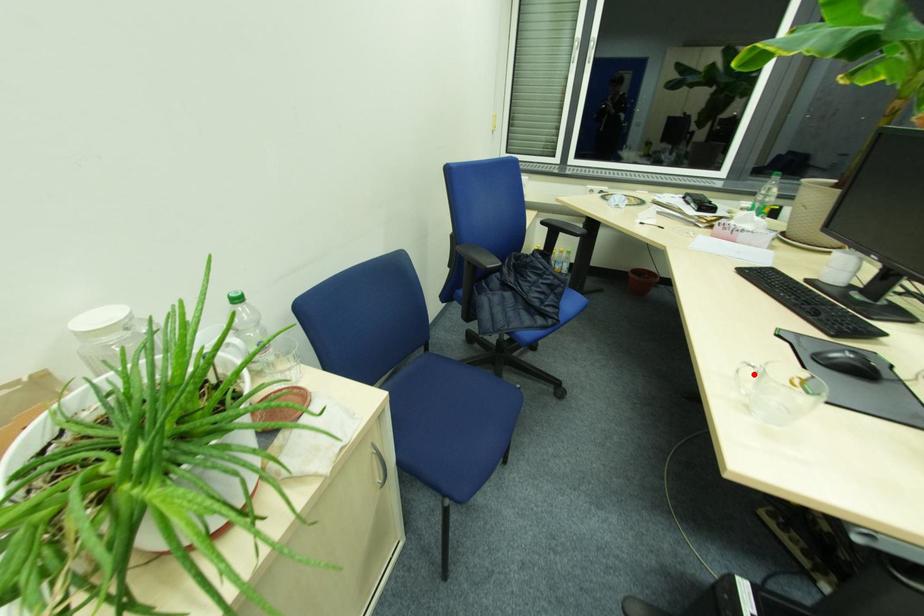
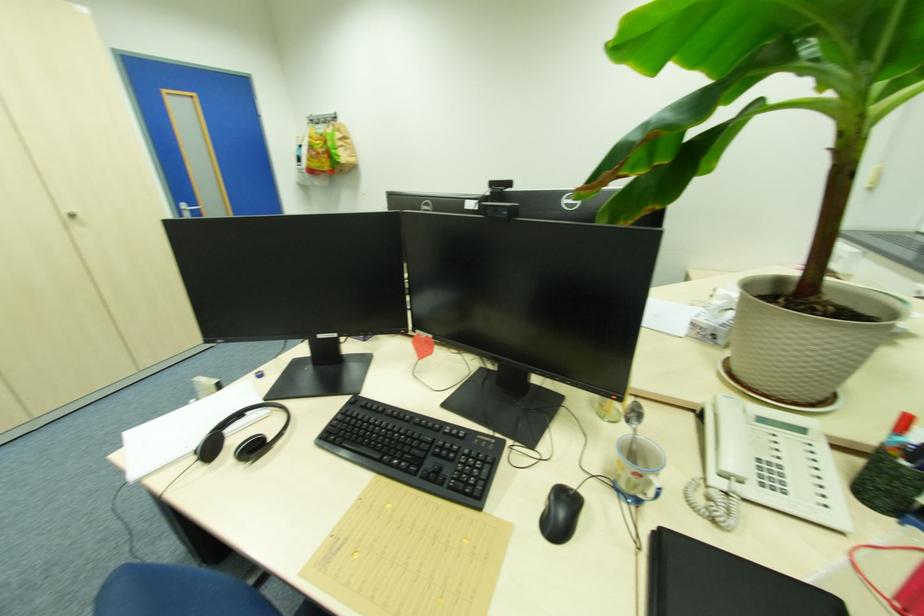
Question: I am providing you with two images of the same scene from different viewpoints. A red point is marked on the first image. Is the red point's position out of view in image 2?

Choices:
 (A) Yes
 (B) No

Answer: (A)